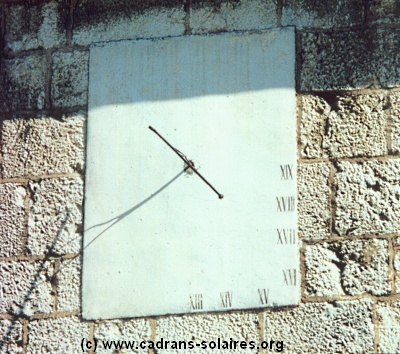
Identify the location of brick wall. (47, 122).